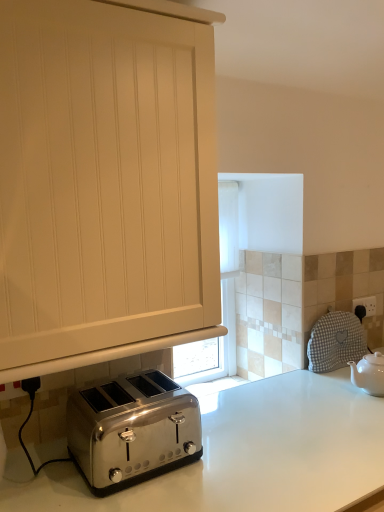
You are a GUI agent. You are given a task and a screenshot of the screen. Output one action in this format:
    pyautogui.click(x=<x>, y=<y>)
    Task: Click on the vacant space underneath white ceramic teapot at right (from a real-world perspective)
    The height and width of the screenshot is (512, 384).
    Given the screenshot: What is the action you would take?
    pyautogui.click(x=368, y=394)